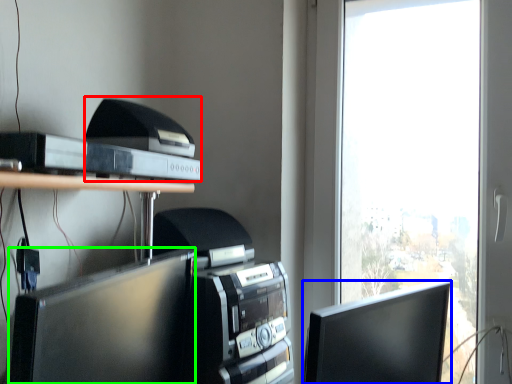
Question: Considering the real-world distances, which object is closest to printer (highlighted by a red box)? computer monitor (highlighted by a blue box) or computer monitor (highlighted by a green box).

Choices:
 (A) computer monitor
 (B) computer monitor

Answer: (B)